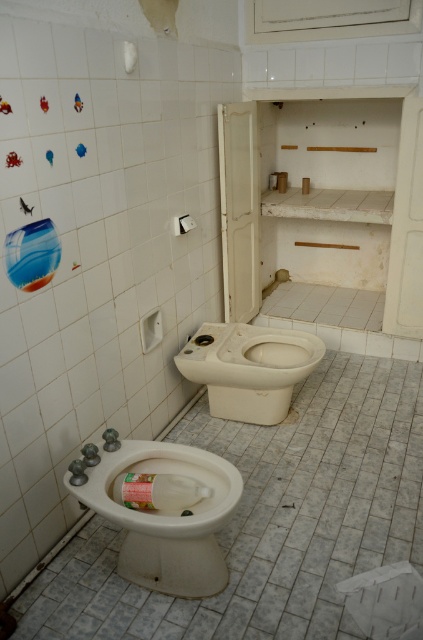
Question: Does white glossy toilet bowl at lower left come in front of white glossy toilet bowl at center?

Choices:
 (A) yes
 (B) no

Answer: (A)

Question: From the image, what is the correct spatial relationship of white glossy toilet bowl at lower left in relation to white glossy toilet bowl at center?

Choices:
 (A) below
 (B) above

Answer: (A)

Question: Among these points, which one is nearest to the camera?

Choices:
 (A) (184, 525)
 (B) (216, 403)

Answer: (A)

Question: Can you confirm if white glossy toilet bowl at lower left is positioned above white glossy toilet bowl at center?

Choices:
 (A) yes
 (B) no

Answer: (B)